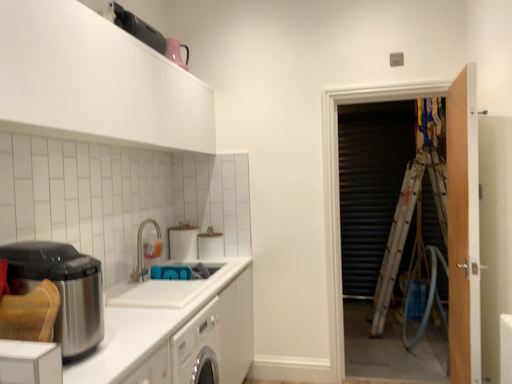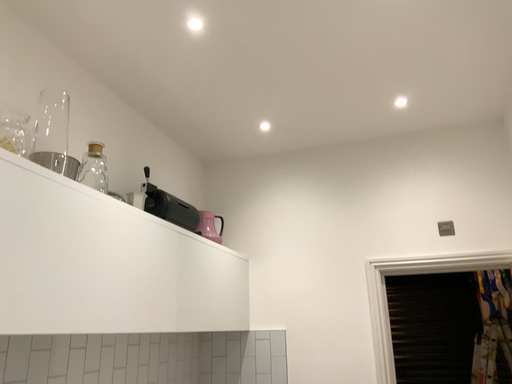
Question: Which way did the camera rotate in the video?

Choices:
 (A) rotated left
 (B) rotated right

Answer: (A)